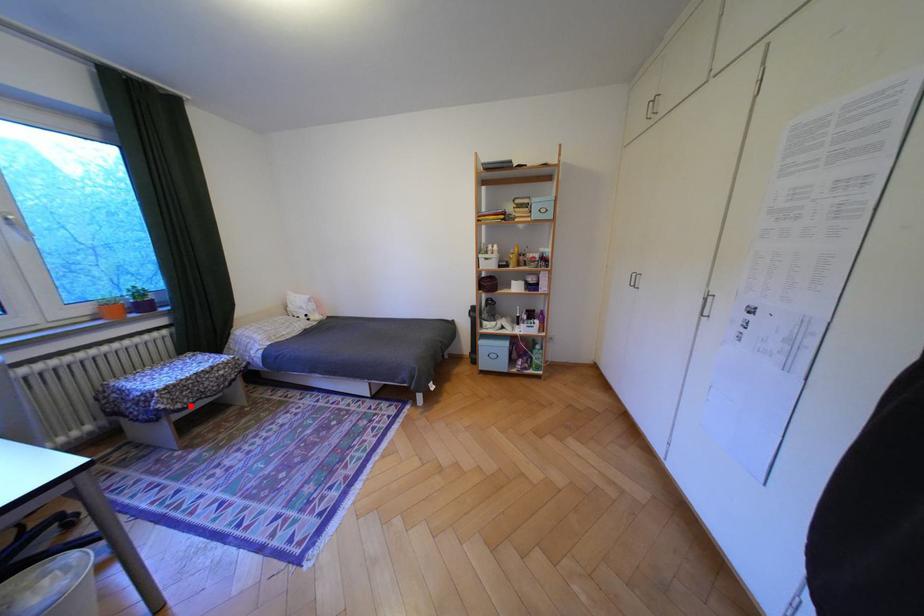
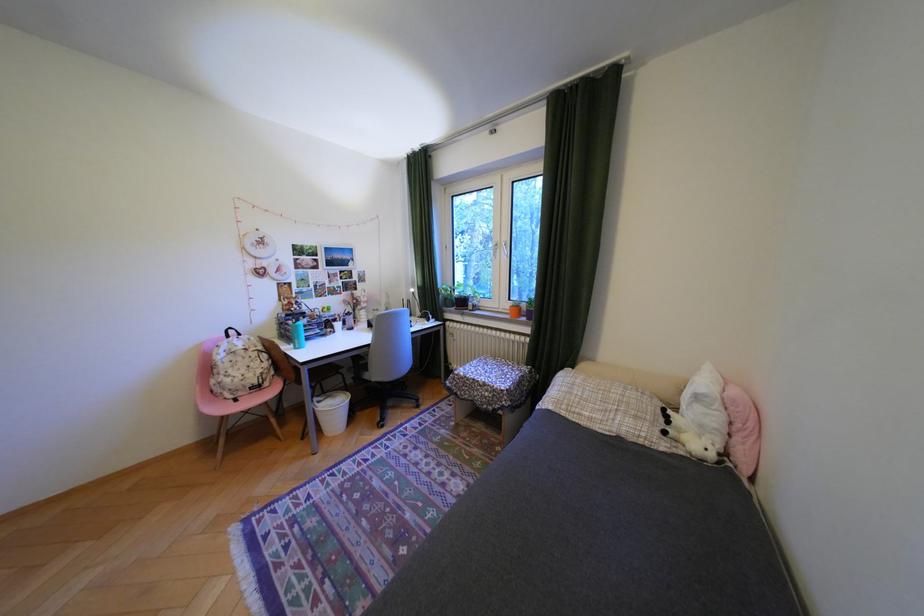
Question: I am providing you with two images of the same scene from different viewpoints. A red point is shown in image1. For the corresponding object point in image2, is it positioned nearer or farther from the camera?

Choices:
 (A) Nearer
 (B) Farther

Answer: (B)